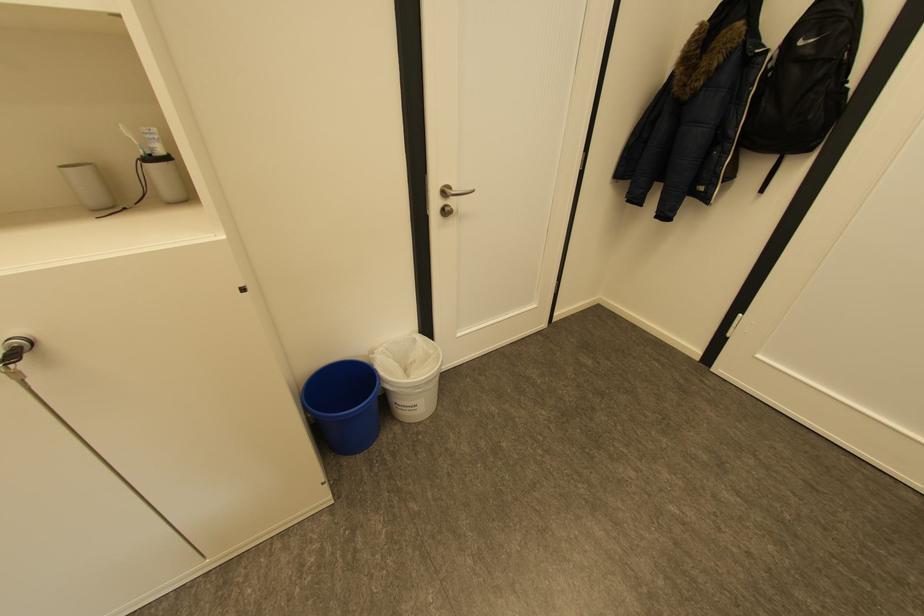
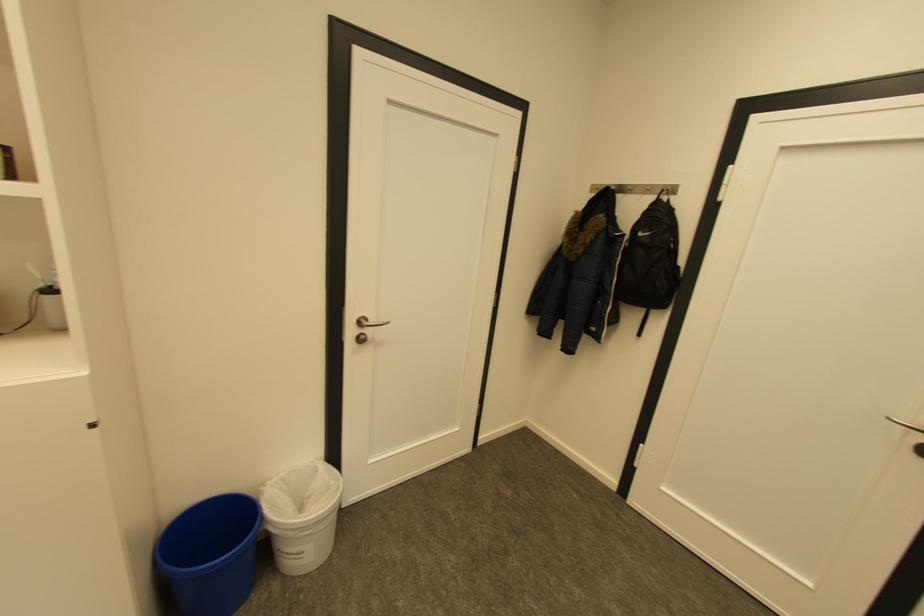
In a continuous first-person perspective shot, in which direction is the camera moving?

The cameraman walked toward right, backward.